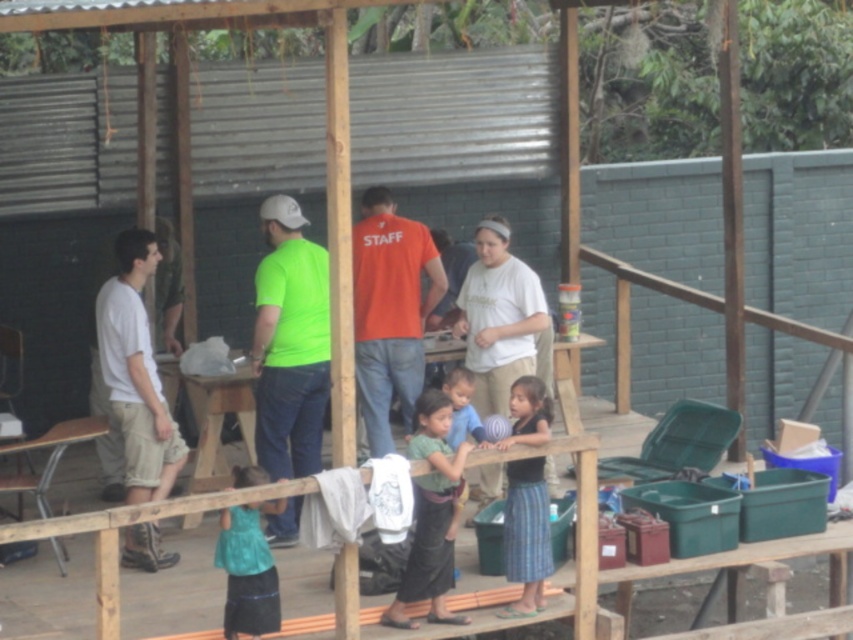
You are a participant in an outdoor event and you need to find the taller skirt between the green woven skirt at center and the blue woven skirt at lower right. Which one should you look for?

The blue woven skirt at lower right is taller than the green woven skirt at center, so you should look for the blue woven skirt at lower right.

You are standing in the outdoor setting and want to determine which of the two points, point (413, 369) or point (148, 353), is closer to you. Based on the scene description, which point is nearer?

Point (413, 369) is further to the viewer than point (148, 353), so the closer point is point (148, 353).